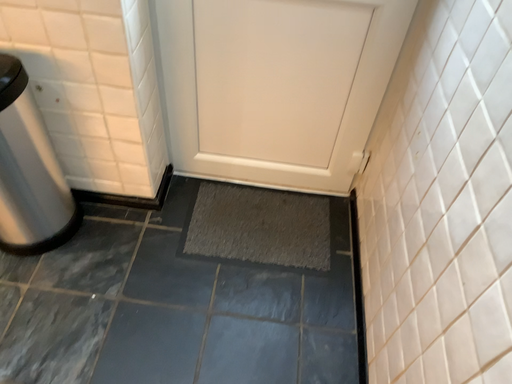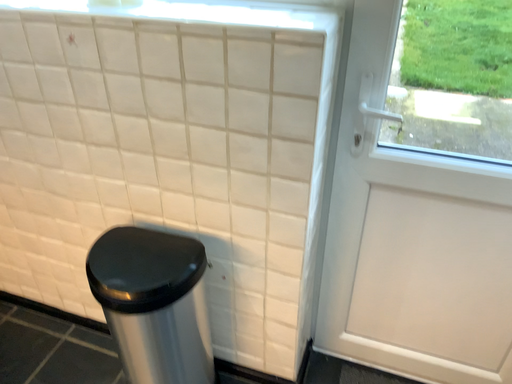
Question: Which way did the camera rotate in the video?

Choices:
 (A) rotated left
 (B) rotated right

Answer: (A)